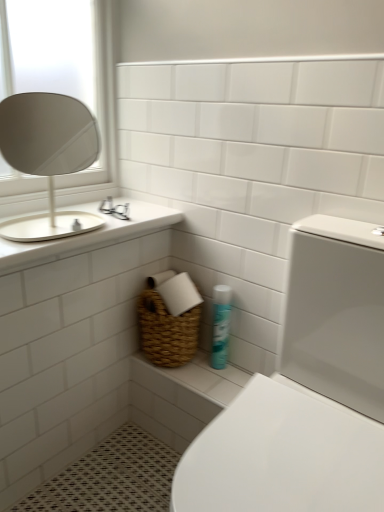
The width and height of the screenshot is (384, 512). In order to click on free point above white glossy countertop at upper left (from a real-world perspective) in this screenshot , I will do `click(74, 212)`.